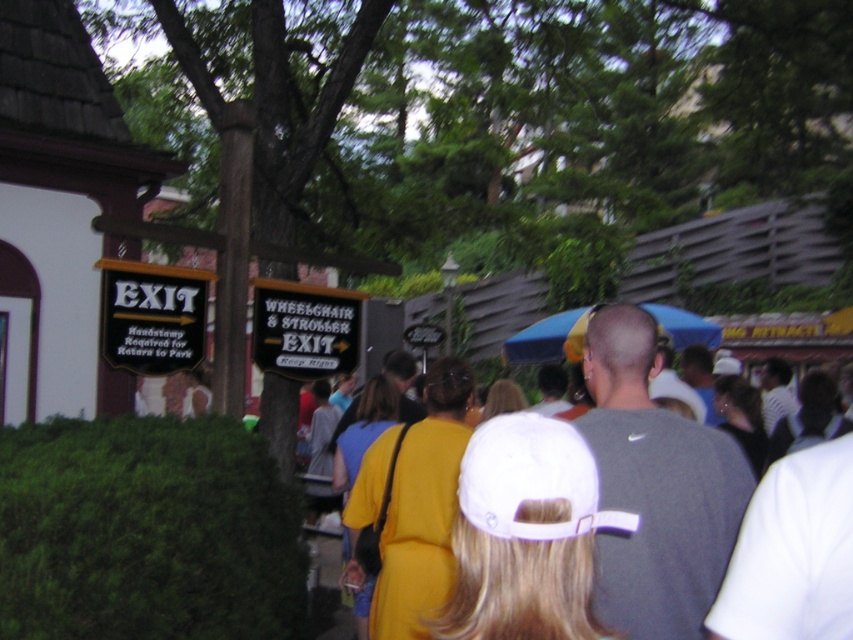
Question: In this image, where is green leafy hedge at lower left located relative to gray matte shirt at center?

Choices:
 (A) left
 (B) right

Answer: (A)

Question: Which point appears farthest from the camera in this image?

Choices:
 (A) (28, 513)
 (B) (463, 170)

Answer: (B)

Question: Does green leafy tree at upper left have a greater width compared to white matte baseball cap at center?

Choices:
 (A) yes
 (B) no

Answer: (A)

Question: Which point is farther to the camera?

Choices:
 (A) (656, 600)
 (B) (469, 518)
 (C) (131, 582)
 (D) (328, 49)

Answer: (D)

Question: Does green leafy hedge at lower left appear under gray matte shirt at center?

Choices:
 (A) yes
 (B) no

Answer: (A)

Question: Among these objects, which one is nearest to the camera?

Choices:
 (A) green leafy tree at upper left
 (B) white matte baseball cap at center
 (C) gray matte shirt at center
 (D) green leafy hedge at lower left

Answer: (B)